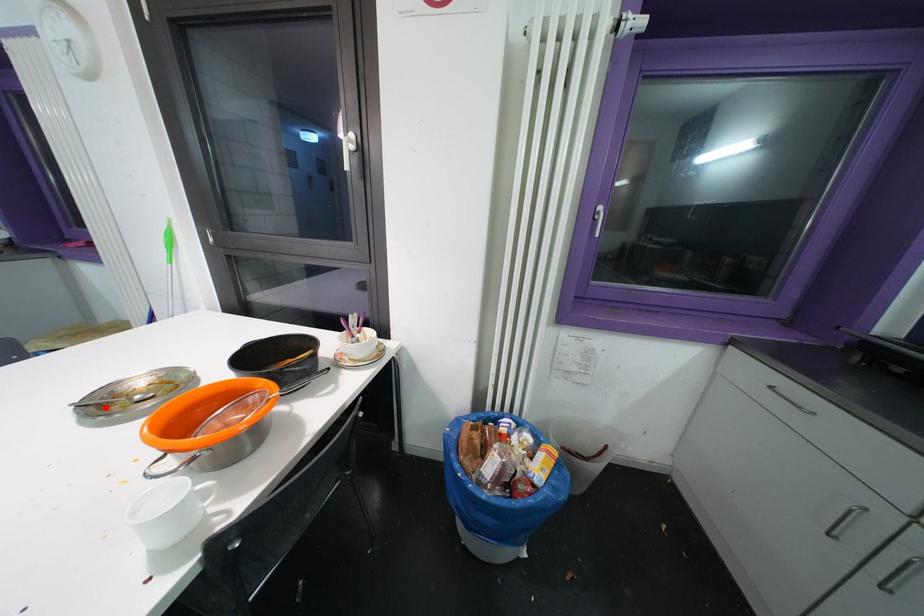
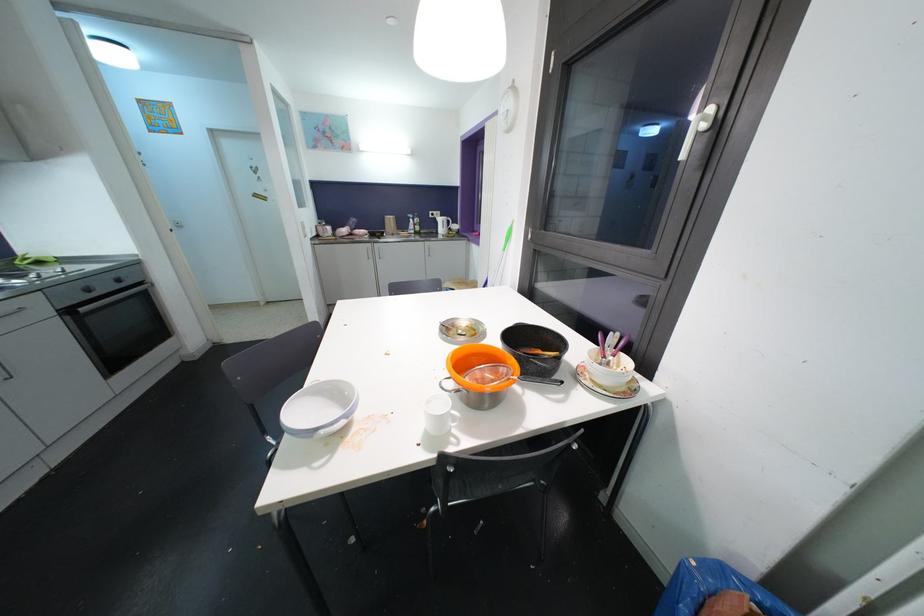
The point at the highlighted location is marked in the first image. Where is the corresponding point in the second image?

(451, 331)